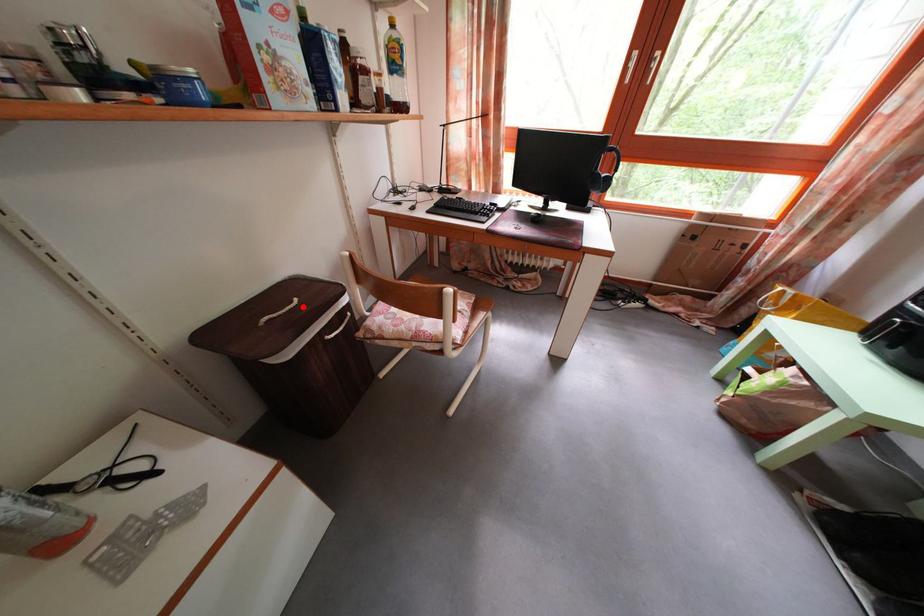
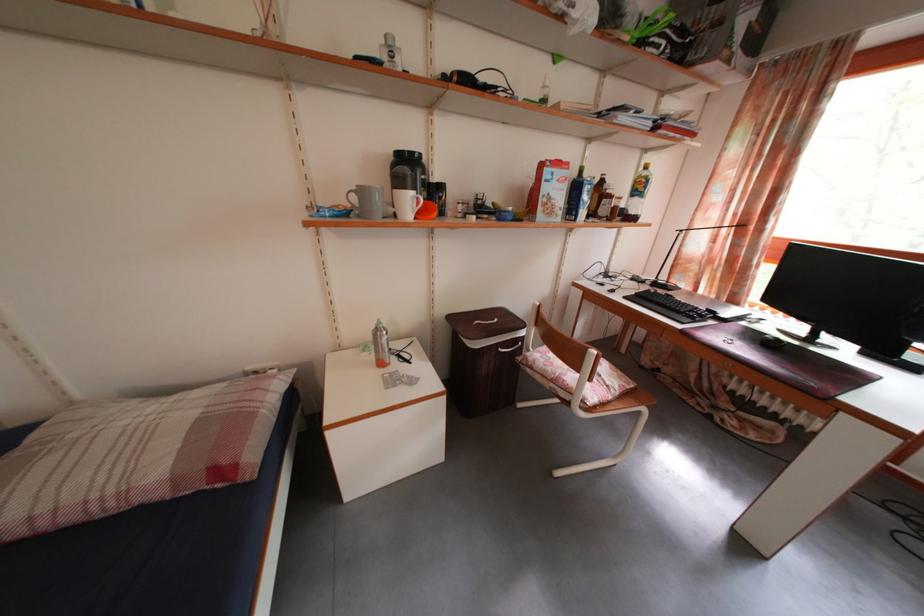
Where in the second image is the point corresponding to the highlighted location from the first image?

(504, 326)